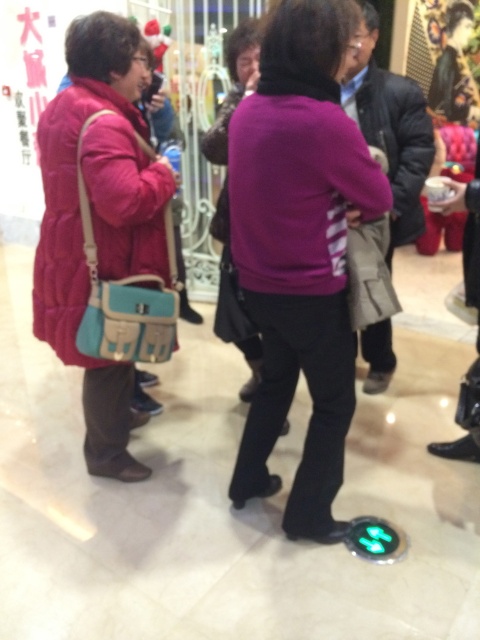
You are standing in the shopping mall and see the point marked at coordinate (300,250). Which object in the scene is this point located on?

The point at coordinate (300,250) is located on the purple matte sweater at center.

You are a delivery robot with a box that is 20 inches long. You need to navigate between the purple matte sweater at center and the quilted red coat at left to deliver the package. Can you fit through the space between them?

The distance between the purple matte sweater at center and the quilted red coat at left is 18.62 inches. Since the box is 20 inches long, it is slightly too long to fit through the space between them.